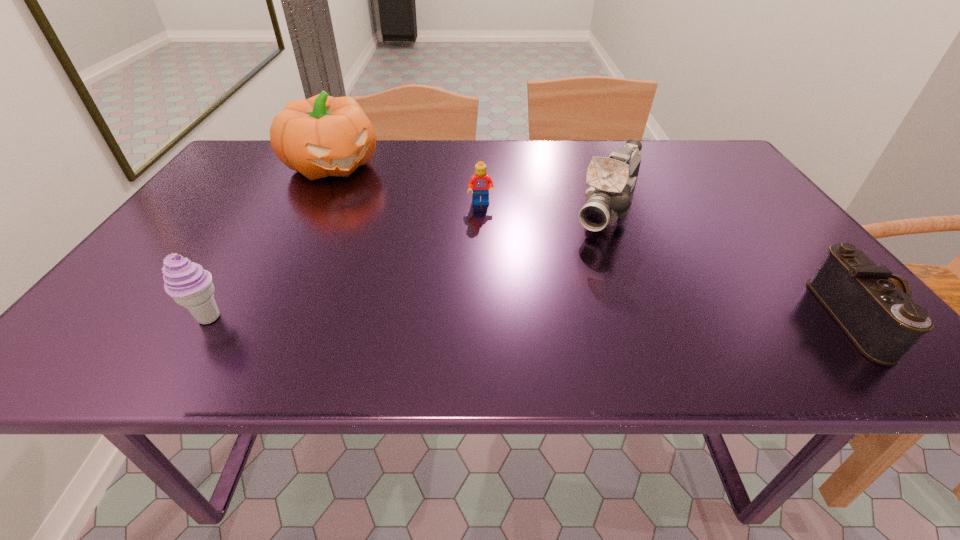
Where is `the third tallest object`? Image resolution: width=960 pixels, height=540 pixels. the third tallest object is located at coordinates (190, 286).

I want to click on the rightmost object, so click(874, 308).

Locate an element on the screen. This screenshot has height=540, width=960. Lego is located at coordinates (479, 184).

This screenshot has height=540, width=960. Identify the location of pumpkin. (321, 136).

Locate an element on the screen. the fourth object from left to right is located at coordinates (612, 180).

Find the location of a particular element. vacant region located on the back of the third shortest object is located at coordinates (268, 222).

Locate an element on the screen. The width and height of the screenshot is (960, 540). free space located on the face of the Lego is located at coordinates (493, 314).

At what (x,y) coordinates should I click in order to perform the action: click on vacant space located on the face of the Lego. Please return your answer as a coordinate pair (x, y). This screenshot has width=960, height=540. Looking at the image, I should click on (486, 249).

Where is `free point located on the face of the Lego`? This screenshot has width=960, height=540. free point located on the face of the Lego is located at coordinates (486, 247).

Where is `vacant space located 0.350m on the carved face of the pumpkin`? The image size is (960, 540). vacant space located 0.350m on the carved face of the pumpkin is located at coordinates (421, 247).